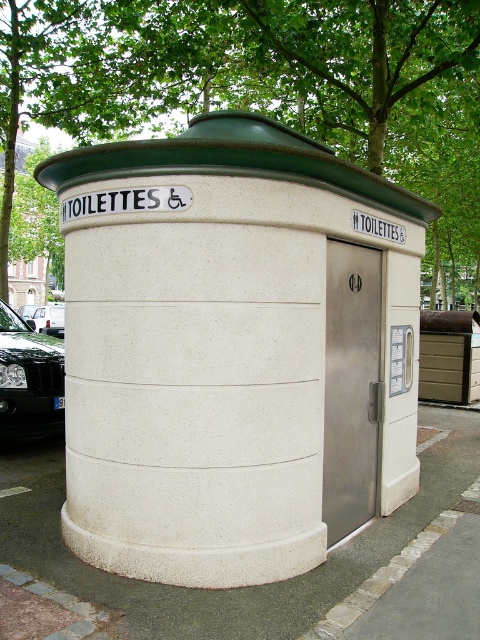
You are standing in front of the public toilet facility and notice a green leafy tree at upper center and a shiny black car at lower left. Which object is closer to you?

The green leafy tree at upper center is closer to you because the shiny black car at lower left is behind it.

You are a delivery person with a cart that is 2 meters wide. You need to move from the shiny black car at lower left to the white concrete toilettes at center. Is there enough space between them for your cart to pass through?

The distance between the white concrete toilettes at center and the shiny black car at lower left is 3.08 meters. Since your cart is 2 meters wide, there is sufficient space for it to pass through.

You are standing in front of the public toilet facility and see the white concrete toilettes at center and the shiny black car at left. Which object is nearer to you?

The white concrete toilettes at center is closer to the viewer than the shiny black car at left.